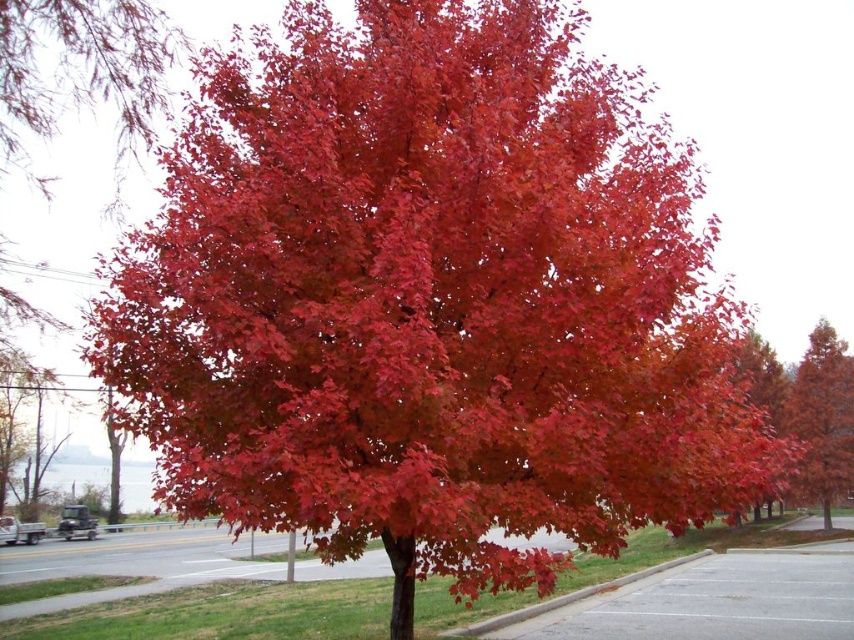
Question: Is glossy red maple at center positioned before gray asphalt curb at lower right?

Choices:
 (A) no
 (B) yes

Answer: (A)

Question: Can you confirm if glossy red maple at center is positioned above gray asphalt curb at lower right?

Choices:
 (A) no
 (B) yes

Answer: (B)

Question: Among these objects, which one is farthest from the camera?

Choices:
 (A) glossy red maple at center
 (B) gray asphalt curb at lower right

Answer: (A)

Question: Does glossy red maple at center have a lesser width compared to gray asphalt curb at lower right?

Choices:
 (A) no
 (B) yes

Answer: (B)